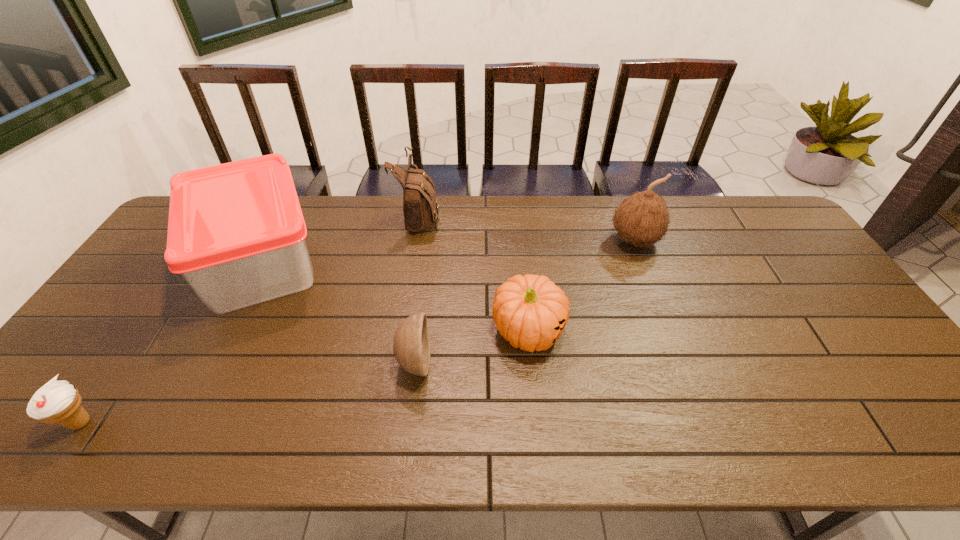
The width and height of the screenshot is (960, 540). What are the coordinates of `vacant space located 0.200m on the left of the bowl` in the screenshot? It's located at [319, 363].

Where is `vacant space located on the back of the nearest object`? Image resolution: width=960 pixels, height=540 pixels. vacant space located on the back of the nearest object is located at coordinates (168, 294).

Find the location of a particular element. The width and height of the screenshot is (960, 540). shoulder bag at the far edge is located at coordinates (420, 207).

The image size is (960, 540). I want to click on coconut that is at the far edge, so click(642, 219).

Where is `tray that is at the far edge`? tray that is at the far edge is located at coordinates (236, 232).

This screenshot has height=540, width=960. I want to click on object that is positioned at the near edge, so click(x=59, y=402).

Identify the location of tray present at the left edge. (236, 232).

Identify the location of icecream located at the left edge. The width and height of the screenshot is (960, 540). (59, 402).

Identify the location of object located at the far left corner. point(236,232).

At what (x,y) coordinates should I click in order to perform the action: click on object that is at the near left corner. Please return your answer as a coordinate pair (x, y). The height and width of the screenshot is (540, 960). Looking at the image, I should click on (59, 402).